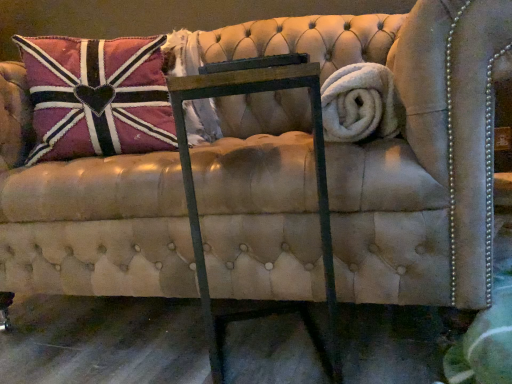
Find the location of `free spot to the left of metal frame at center`. free spot to the left of metal frame at center is located at coordinates (157, 347).